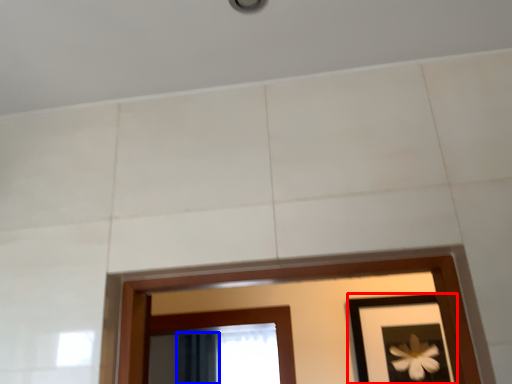
Question: Which object is closer to the camera taking this photo, picture frame (highlighted by a red box) or curtain (highlighted by a blue box)?

Choices:
 (A) picture frame
 (B) curtain

Answer: (A)